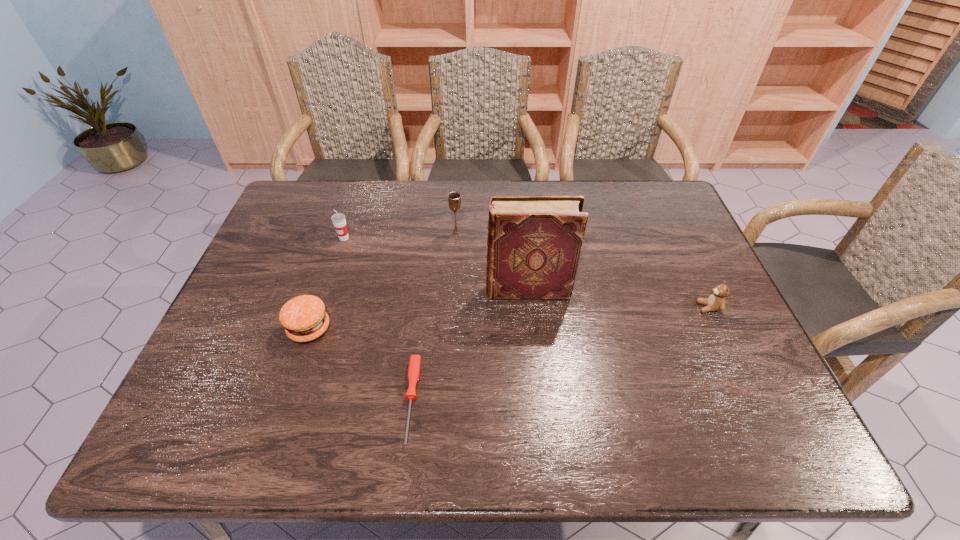
At what (x,y) coordinates should I click in order to perform the action: click on vacant space at the far edge of the desktop. Please return your answer as a coordinate pair (x, y). The width and height of the screenshot is (960, 540). Looking at the image, I should click on (384, 222).

I want to click on blank space at the near edge, so click(654, 423).

In the image, there is a desktop. At what (x,y) coordinates should I click in order to perform the action: click on vacant space at the left edge. Please return your answer as a coordinate pair (x, y). The height and width of the screenshot is (540, 960). Looking at the image, I should click on (291, 226).

I want to click on free spot at the far left corner of the desktop, so click(x=279, y=211).

The height and width of the screenshot is (540, 960). Identify the location of free location at the near left corner. (174, 431).

In the image, there is a desktop. Where is `free space at the far right corner`? Image resolution: width=960 pixels, height=540 pixels. free space at the far right corner is located at coordinates (650, 181).

Image resolution: width=960 pixels, height=540 pixels. Identify the location of vacant space that's between the third tallest object and the patty. (326, 284).

I want to click on free spot between the patty and the nearest object, so [361, 364].

This screenshot has width=960, height=540. What are the coordinates of `vacant space that's between the hardback book and the patty` in the screenshot? It's located at (419, 309).

Find the location of a particular element. Image resolution: width=960 pixels, height=540 pixels. unoccupied position between the patty and the rightmost object is located at coordinates (509, 318).